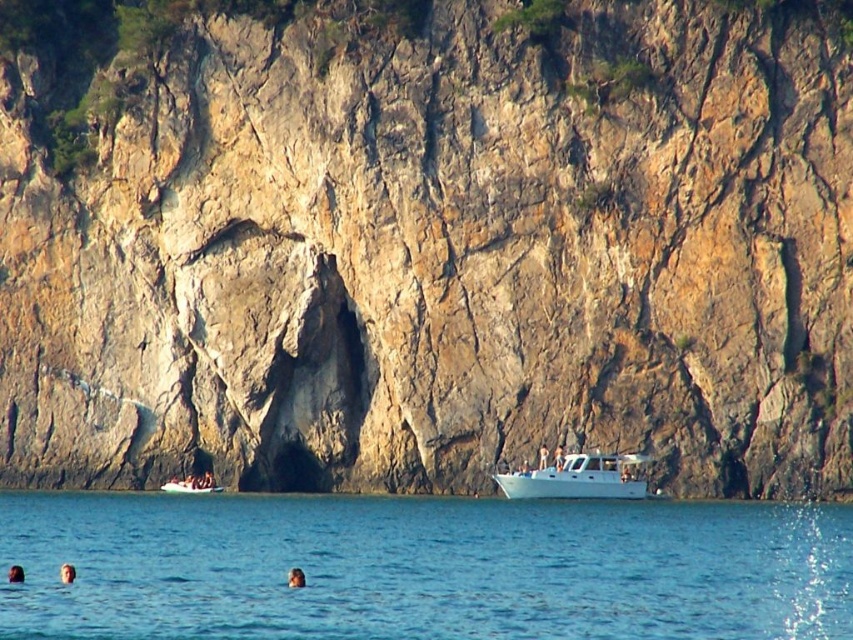
You are standing on the cliff and see the blue water at lower center and the smooth skin head at lower center. Which object is closer to you?

The blue water at lower center is closer to you because it is in front of the smooth skin head at lower center.

Looking at this image, you are standing on the cliff and see the blue water at lower center and the white matte person at lower center. Which object is taller from your perspective?

The blue water at lower center is much taller than the white matte person at lower center from your perspective.

You are a photographer planning to take a picture of the blue water at lower center and the white matte person at lower center. Which object will occupy more space in the photo?

The blue water at lower center is larger in size than the white matte person at lower center, so it will occupy more space in the photo.